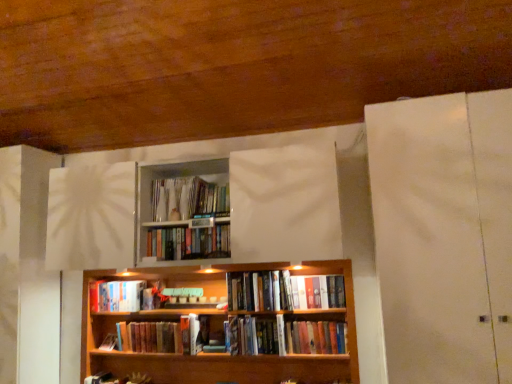
The image size is (512, 384). I want to click on free point above hardcover book at center, acting as the first book starting from the bottom (from a real-world perspective), so click(x=143, y=320).